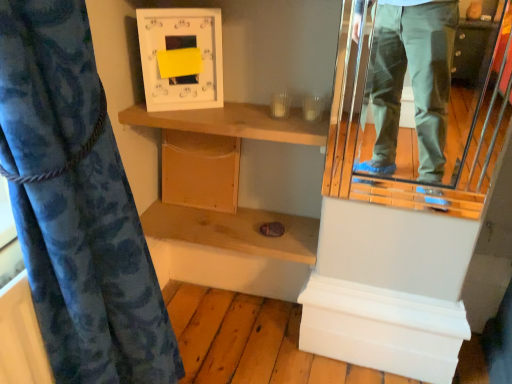
The image size is (512, 384). I want to click on free space to the right of wooden cabinet at center, so click(253, 218).